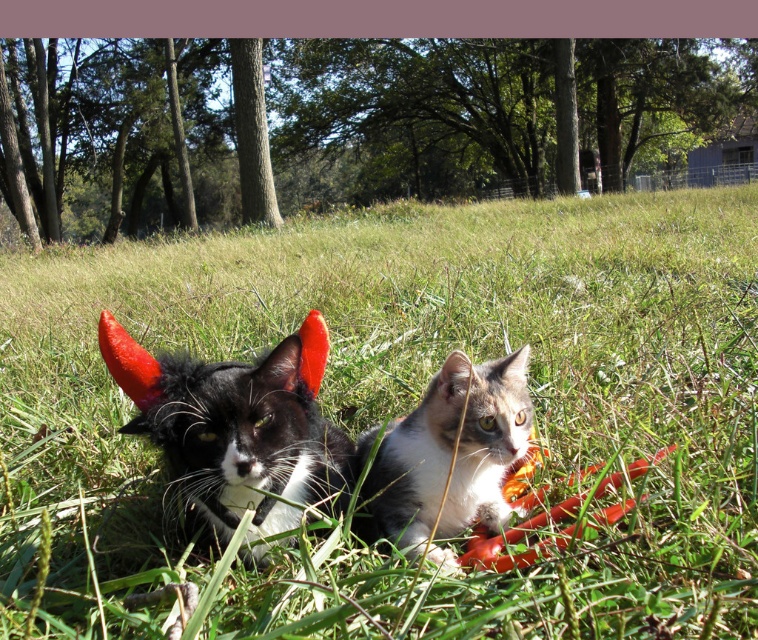
You are a photographer trying to capture a closeup shot of the tabby fur cat at center. Since the green grass at center is blocking the view, can you determine if you can move the grass aside to get a clear shot?

The green grass at center is larger in size than the tabby fur cat at center. Since the grass is bigger, it might be harder to move aside, but you can try trimming or gently pushing the grass out of the way to get a clear shot of the cat.